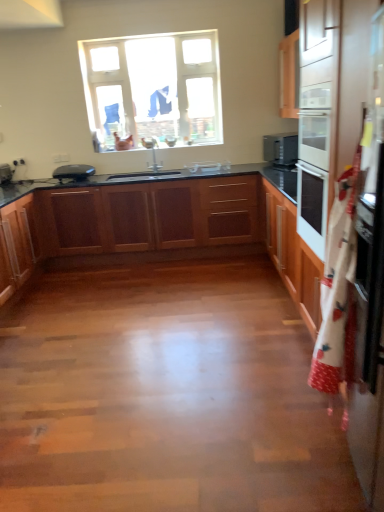
Question: Looking at their shapes, would you say clear glass window at upper center is wider or thinner than wooden cabinets at center, marked as the first cabinetry in a back-to-front arrangement?

Choices:
 (A) thin
 (B) wide

Answer: (A)

Question: In the image, is clear glass window at upper center on the left side or the right side of wooden cabinets at center, the 3th cabinetry viewed from the front?

Choices:
 (A) left
 (B) right

Answer: (B)

Question: Based on their relative distances, which object is farther from the clear glass window at upper center?

Choices:
 (A) matte black toaster at left
 (B) wooden cabinets at center, the 3th cabinetry viewed from the front
 (C) white fabric apron at right
 (D) satin black microwave at upper right
 (E) wooden cabinet at left, placed as the second cabinetry when sorted from back to front

Answer: (C)

Question: Estimate the real-world distances between objects in this image. Which object is farther from the wooden cabinets at center, marked as the first cabinetry in a back-to-front arrangement?

Choices:
 (A) wooden cabinet at left, which is counted as the second cabinetry, starting from the front
 (B) wooden floor at center
 (C) clear glass window at upper center
 (D) matte black toaster at left
 (E) wooden cabinets at center, which is counted as the first cabinetry, starting from the front

Answer: (D)